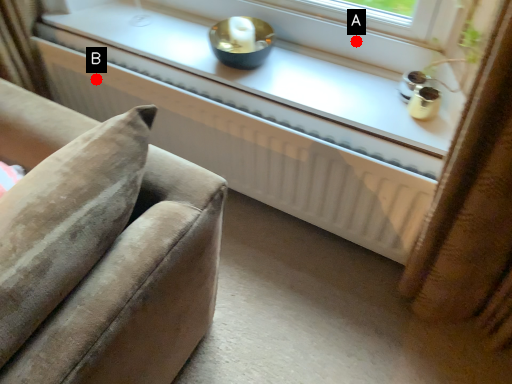
Question: Two points are circled on the image, labeled by A and B beside each circle. Which point is closer to the camera?

Choices:
 (A) A is closer
 (B) B is closer

Answer: (A)